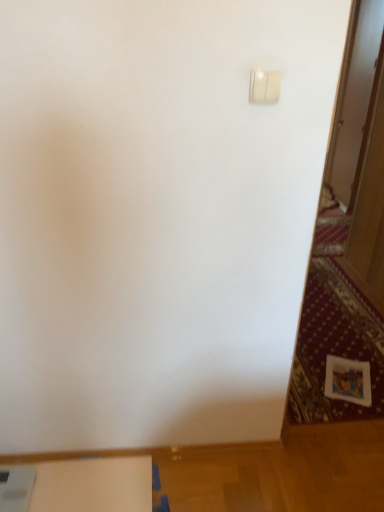
This screenshot has width=384, height=512. Describe the element at coordinates (94, 485) in the screenshot. I see `white matte table at lower left` at that location.

Identify the location of white matte table at lower left. (94, 485).

In the scene shown: In order to face white matte table at lower left, should I rotate leftwards or rightwards?

To align with it, rotate left about 14.373°.

Locate an element on the screen. This screenshot has height=512, width=384. white plastic light switch at upper right is located at coordinates (264, 86).

Describe the element at coordinates (264, 86) in the screenshot. This screenshot has height=512, width=384. I see `white plastic light switch at upper right` at that location.

In order to click on white matte table at lower left in this screenshot , I will do `click(94, 485)`.

Is white plastic light switch at upper right at the right side of white matte table at lower left?

Yes.

Which object is more forward, white plastic light switch at upper right or white matte table at lower left?

white plastic light switch at upper right is in front.

Does point (256, 76) appear closer or farther from the camera than point (130, 477)?

Point (256, 76).

From the image's perspective, which is below, white plastic light switch at upper right or white matte table at lower left?

white matte table at lower left.

From a real-world perspective, is white plastic light switch at upper right on top of white matte table at lower left?

Yes, from a real-world perspective, white plastic light switch at upper right is over white matte table at lower left

Considering the relative sizes of white plastic light switch at upper right and white matte table at lower left in the image provided, is white plastic light switch at upper right thinner than white matte table at lower left?

Yes.

Considering the relative sizes of white plastic light switch at upper right and white matte table at lower left in the image provided, is white plastic light switch at upper right taller than white matte table at lower left?

Yes.

Can you confirm if white plastic light switch at upper right is bigger than white matte table at lower left?

Incorrect, white plastic light switch at upper right is not larger than white matte table at lower left.

Is white plastic light switch at upper right not inside white matte table at lower left?

white plastic light switch at upper right is positioned outside white matte table at lower left.

Is white plastic light switch at upper right in contact with white matte table at lower left?

No, white plastic light switch at upper right is not next to white matte table at lower left.

Could you tell me if white plastic light switch at upper right is turned towards white matte table at lower left?

No, white plastic light switch at upper right is not facing towards white matte table at lower left.

How different are the orientations of white plastic light switch at upper right and white matte table at lower left in degrees?

There is a 8.63-degree angle between the facing directions of white plastic light switch at upper right and white matte table at lower left.

The height and width of the screenshot is (512, 384). I want to click on table below the white plastic light switch at upper right (from the image's perspective), so coord(94,485).

Based on their positions, is white matte table at lower left located to the left or right of white plastic light switch at upper right?

From the image, it's evident that white matte table at lower left is to the left of white plastic light switch at upper right.

Does white matte table at lower left come behind white plastic light switch at upper right?

Yes.

Which is farther from the camera, (x=69, y=468) or (x=270, y=79)?

Positioned behind is point (x=69, y=468).

From the image's perspective, which is below, white matte table at lower left or white plastic light switch at upper right?

white matte table at lower left is shown below in the image.

From a real-world perspective, who is located higher, white matte table at lower left or white plastic light switch at upper right?

In real-world perspective, white plastic light switch at upper right is above.

Which object is thinner, white matte table at lower left or white plastic light switch at upper right?

white plastic light switch at upper right.

Which of these two, white matte table at lower left or white plastic light switch at upper right, stands taller?

With more height is white plastic light switch at upper right.

Between white matte table at lower left and white plastic light switch at upper right, which one has smaller size?

white plastic light switch at upper right.

Is white matte table at lower left spatially inside white plastic light switch at upper right, or outside of it?

white matte table at lower left cannot be found inside white plastic light switch at upper right.

Would you say white matte table at lower left is a long distance from white plastic light switch at upper right?

Indeed, white matte table at lower left is not near white plastic light switch at upper right.

Is white plastic light switch at upper right at the back of white matte table at lower left?

white matte table at lower left does not have its back to white plastic light switch at upper right.

How far apart are white matte table at lower left and white plastic light switch at upper right?

white matte table at lower left and white plastic light switch at upper right are 4.70 feet apart from each other.

At what (x,y) coordinates should I click in order to perform the action: click on light switch lying in front of the white matte table at lower left. Please return your answer as a coordinate pair (x, y). Looking at the image, I should click on (264, 86).

Locate an element on the screen. Image resolution: width=384 pixels, height=512 pixels. table on the left of the white plastic light switch at upper right is located at coordinates (94, 485).

Find the location of `table below the white plastic light switch at upper right (from the image's perspective)`. table below the white plastic light switch at upper right (from the image's perspective) is located at coordinates (94, 485).